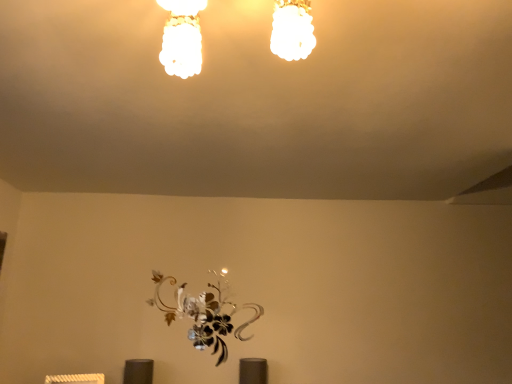
Question: Considering their positions, is matte glass chandelier at upper center located in front of or behind metallic silver flower at center?

Choices:
 (A) behind
 (B) front

Answer: (B)

Question: Based on their sizes in the image, would you say matte glass chandelier at upper center is bigger or smaller than metallic silver flower at center?

Choices:
 (A) small
 (B) big

Answer: (B)

Question: Is matte glass chandelier at upper center spatially inside metallic silver flower at center, or outside of it?

Choices:
 (A) outside
 (B) inside

Answer: (A)

Question: Is metallic silver flower at center in front of or behind matte glass chandelier at upper center in the image?

Choices:
 (A) front
 (B) behind

Answer: (B)

Question: Is metallic silver flower at center taller or shorter than matte glass chandelier at upper center?

Choices:
 (A) short
 (B) tall

Answer: (B)

Question: Looking at their shapes, would you say metallic silver flower at center is wider or thinner than matte glass chandelier at upper center?

Choices:
 (A) wide
 (B) thin

Answer: (B)

Question: From the image's perspective, is metallic silver flower at center above or below matte glass chandelier at upper center?

Choices:
 (A) above
 (B) below

Answer: (B)